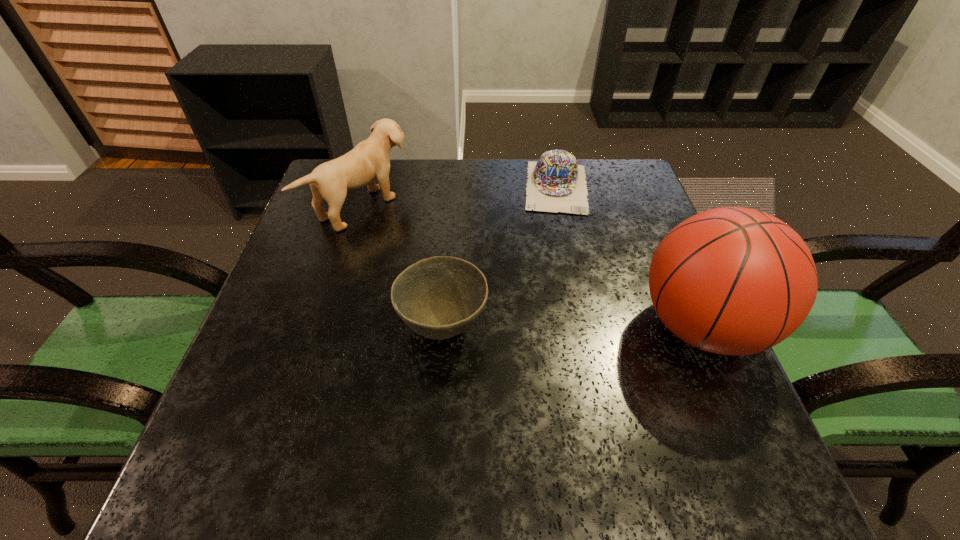
This screenshot has height=540, width=960. I want to click on the second shortest object, so click(x=440, y=297).

At what (x,y) coordinates should I click in order to perform the action: click on bowl. Please return your answer as a coordinate pair (x, y). This screenshot has height=540, width=960. Looking at the image, I should click on (440, 297).

Locate an element on the screen. The width and height of the screenshot is (960, 540). basketball is located at coordinates (733, 281).

The height and width of the screenshot is (540, 960). Find the location of `the tallest object`. the tallest object is located at coordinates (733, 281).

Find the location of a particular element. The image size is (960, 540). puppy is located at coordinates (369, 159).

Locate an element on the screen. The height and width of the screenshot is (540, 960). the second tallest object is located at coordinates pyautogui.click(x=369, y=159).

Find the location of a particular element. This screenshot has width=960, height=540. the third object from left to right is located at coordinates (556, 183).

At what (x,y) coordinates should I click in order to perform the action: click on the shortest object. Please return your answer as a coordinate pair (x, y). Image resolution: width=960 pixels, height=540 pixels. Looking at the image, I should click on (556, 183).

Locate an element on the screen. free space located on the right of the second shortest object is located at coordinates (528, 327).

Locate an element on the screen. vacant space situated on the left of the rightmost object is located at coordinates coord(511,327).